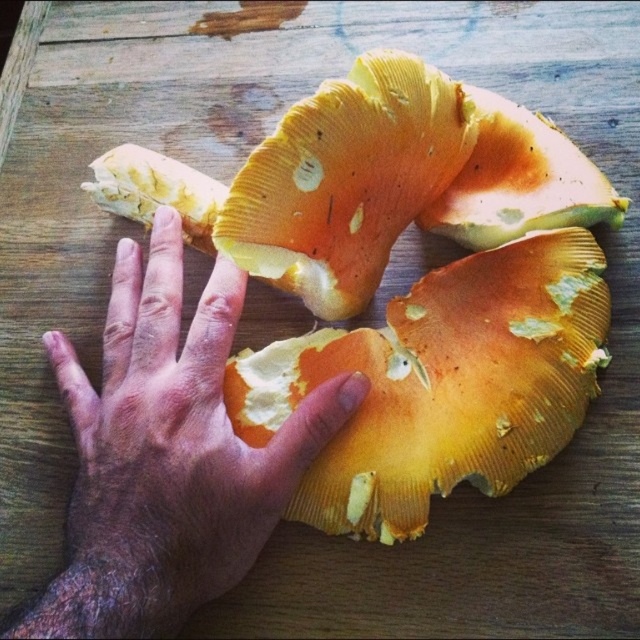
Question: Does yellow soft mushroom at center come behind dry skin at center?

Choices:
 (A) yes
 (B) no

Answer: (A)

Question: Which object is closer to the camera taking this photo?

Choices:
 (A) yellow soft mushroom at center
 (B) dry skin at center

Answer: (B)

Question: Is the position of yellow soft mushroom at center less distant than that of dry skin at center?

Choices:
 (A) yes
 (B) no

Answer: (B)

Question: Which point is farther from the camera taking this photo?

Choices:
 (A) (448, 464)
 (B) (106, 445)

Answer: (A)

Question: Is yellow soft mushroom at center closer to the viewer compared to dry skin at center?

Choices:
 (A) yes
 (B) no

Answer: (B)